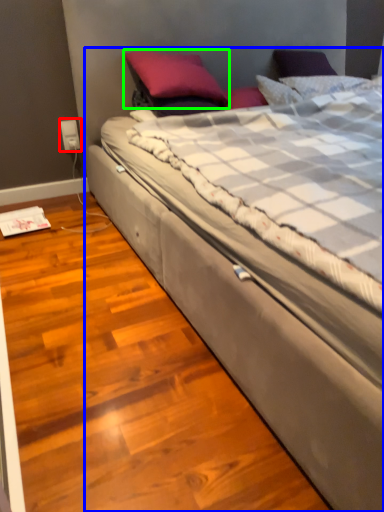
Question: Considering the real-world distances, which object is farthest from electric outlet (highlighted by a red box)? bed (highlighted by a blue box) or pillow (highlighted by a green box)?

Choices:
 (A) bed
 (B) pillow

Answer: (A)